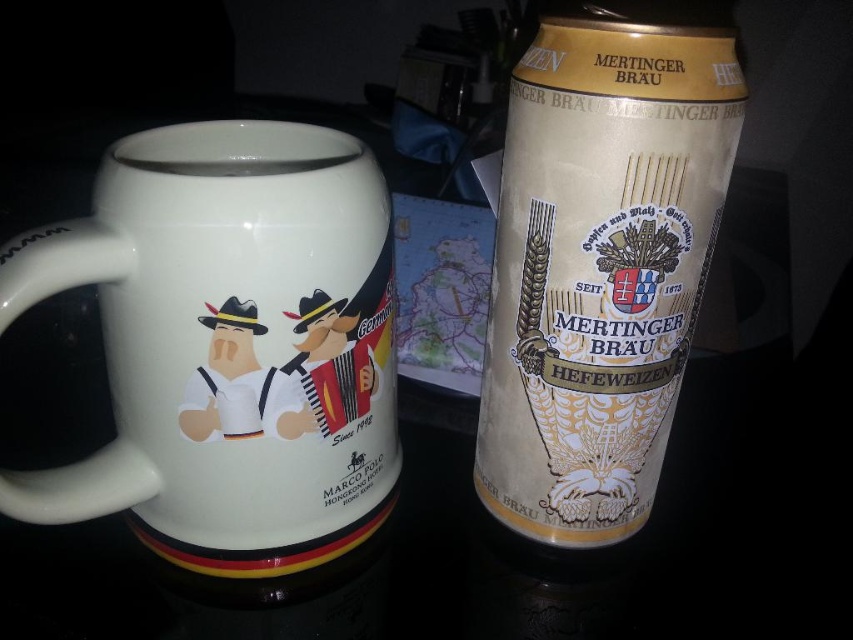
You are organizing items on a shelf and need to stack the white ceramic mug at left and the gold matte beer can at right vertically. Which item should you place at the bottom to ensure stability?

The gold matte beer can at right is taller than the white ceramic mug at left, so placing the taller can at the bottom would provide better stability for the stack.

You are looking at the image of the mug and the beer can on the dark surface. There are two points marked in the image. The first point is at coordinates point (196, 253) and the second point is at point (605, 500). If you were to draw a straight line from the camera to each point, which point would the line reach first?

The line from the camera would reach point (196, 253) first because it is closer to the camera than point (605, 500).

You are a delivery person who needs to place a small package on the table where the white ceramic mug at left is located. The package requires a space of 10 cm x 10 cm. Can you place it next to the mug without moving the mug?

The white ceramic mug at left is positioned at point (228, 346). Since the package requires 10 cm x 10 cm space, and there is no information about the table size or other obstructions, it is uncertain if there is enough space. Check the table dimensions or look for nearby empty areas.